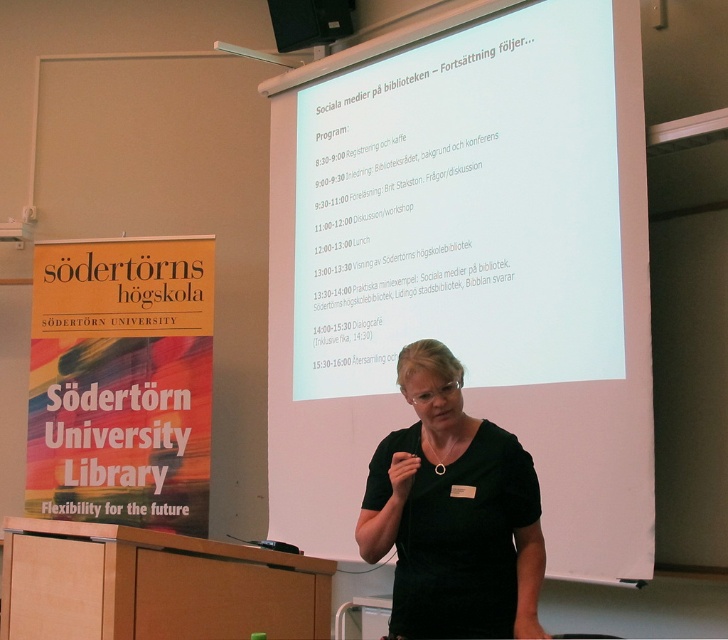
You are an attendee at Sodertorn University and you want to take a photo of the presentation. You have a camera with a 1.5 meter wide lens. The white matte projection screen at center and the black matte dress at center are both in your view. Can your camera capture both objects in one shot without moving the camera?

The white matte projection screen at center might be wider than black matte dress at center. Since the camera lens is 1.5 meters wide, if the projection screen is wider than the dress, it depends on their actual widths. However, without exact measurements, we cannot confirm if both will fit. Please check the actual widths.

You are an attendee at the presentation at Sodertorns Hogskola. You notice two points on the projection screen behind the speaker. Which point is closer to you, point (364,314) or point (446,358)?

Point (364,314) is further to the viewer than point (446,358), so point (446,358) is closer to you.